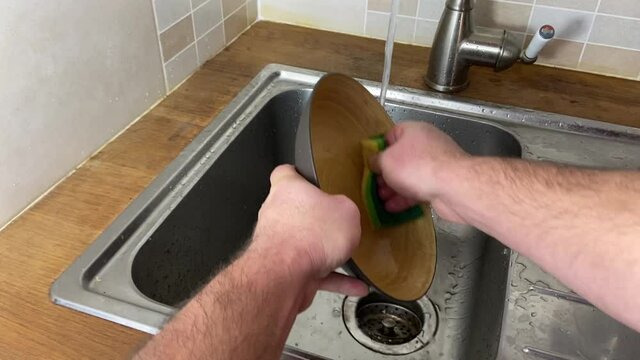
At what (x,y) coordinates should I click in order to perform the action: click on kitchen surface above the sink. Please return your answer as a coordinate pair (x, y). Looking at the image, I should click on (556, 88).